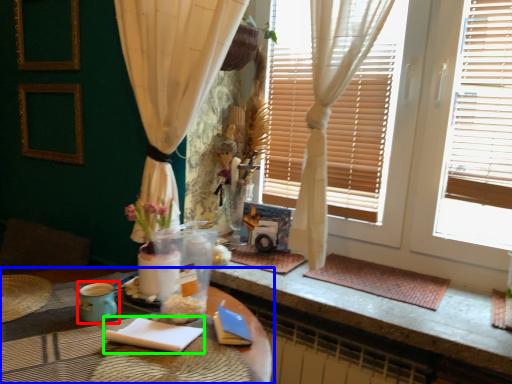
Question: Which object is positioned closest to teal (highlighted by a red box)? Select from table (highlighted by a blue box) and notepad (highlighted by a green box).

Choices:
 (A) table
 (B) notepad

Answer: (B)